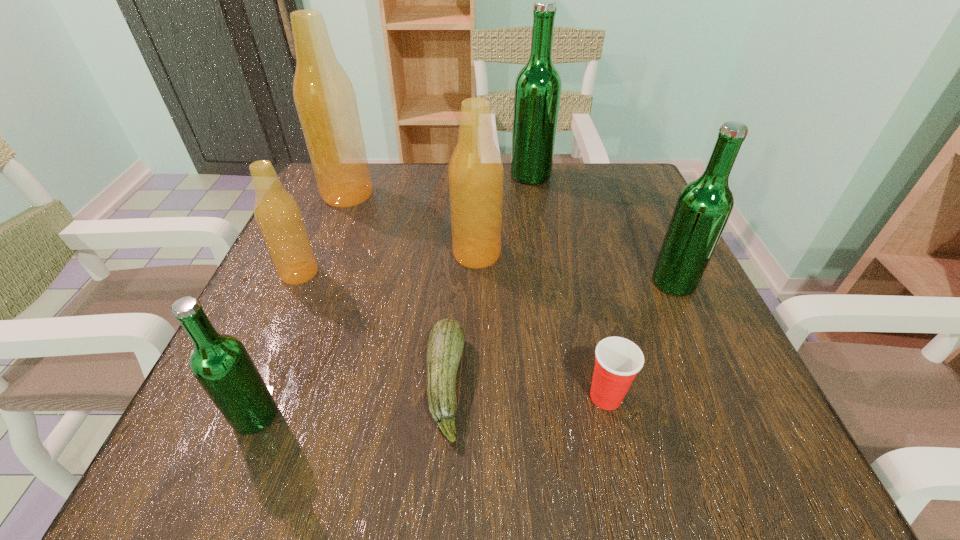
Identify the location of the biggest green beer bottle. This screenshot has height=540, width=960. tap(538, 86).

Image resolution: width=960 pixels, height=540 pixels. Find the location of `the second beer bottle from right to left`. the second beer bottle from right to left is located at coordinates (538, 86).

Identify the location of the farthest tan beer bottle. (325, 100).

This screenshot has width=960, height=540. I want to click on the third beer bottle from right to left, so click(476, 173).

In order to click on the rightmost tan beer bottle in this screenshot , I will do `click(476, 173)`.

Where is `the second biggest green beer bottle`? the second biggest green beer bottle is located at coordinates (703, 208).

Locate an element on the screen. the rightmost beer bottle is located at coordinates (703, 208).

Where is `the smallest tan beer bottle`? the smallest tan beer bottle is located at coordinates (278, 216).

At what (x,y) coordinates should I click in order to perform the action: click on the smallest green beer bottle. Please return your answer as a coordinate pair (x, y). This screenshot has width=960, height=540. Looking at the image, I should click on (221, 364).

Identify the location of the nearest green beer bottle. (221, 364).